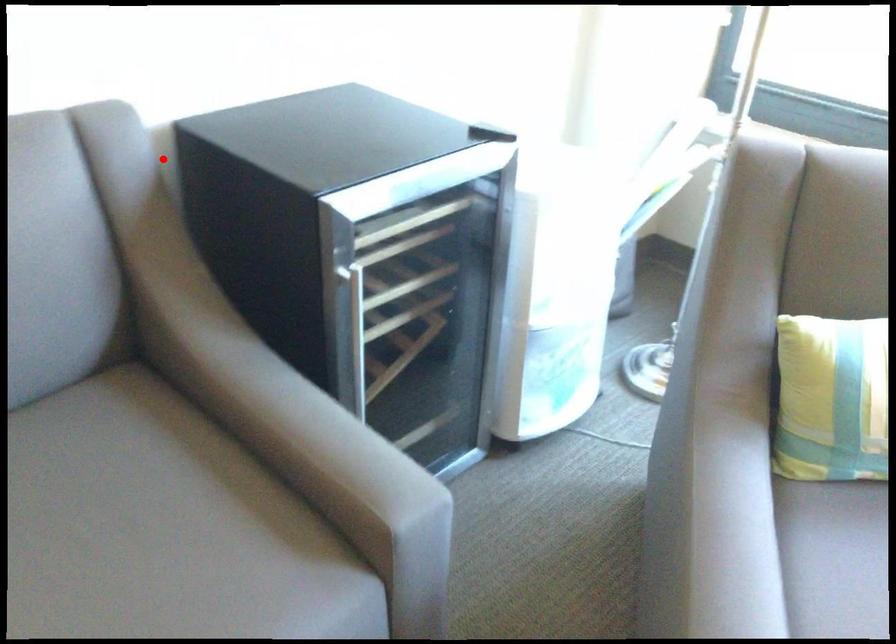
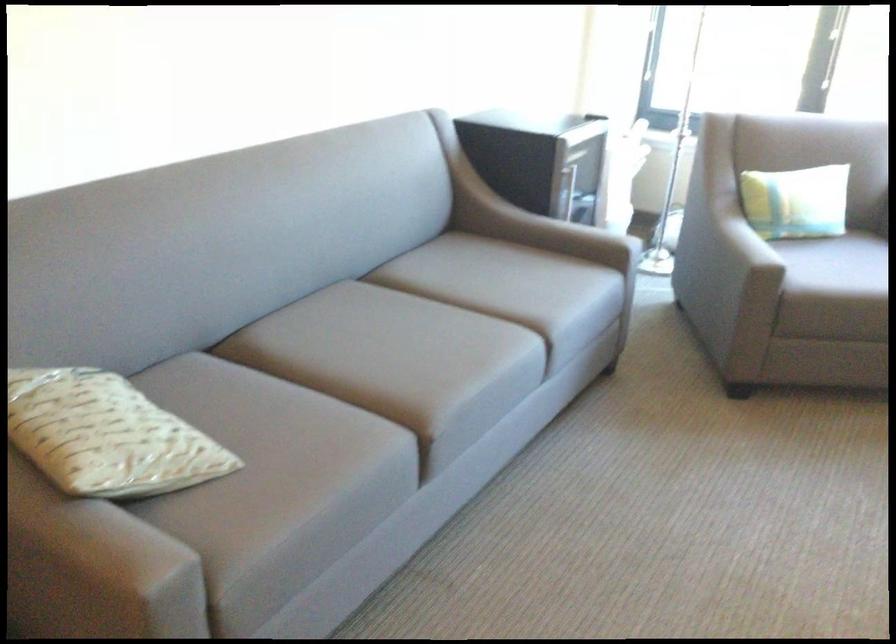
Question: I am providing you with two images of the same scene from different viewpoints. A red point is marked on the first image. Can you still see the location of the red point in image 2?

Choices:
 (A) Yes
 (B) No

Answer: (B)